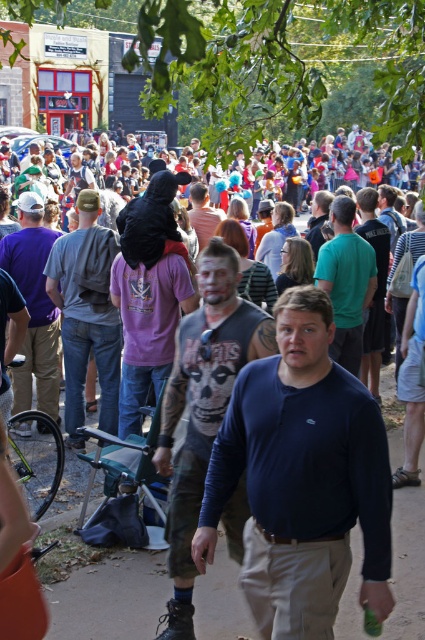
You are a photographer at the event and want to capture both the denim jeans at center and the matte black shirt at center in a single photo. Since you can only focus on one subject at a time, which one should you focus on to ensure the other remains in the background?

You should focus on the denim jeans at center because it is in front of the matte black shirt at center, so if you focus on the denim jeans at center, the matte black shirt at center will naturally be in the background.

You are a photographer trying to capture both individuals in the scene. Given their positions at point coordinates point [71,397] and point [50,342], which point is closer to your camera lens?

Point [71,397] is closer to the camera lens than point [50,342].